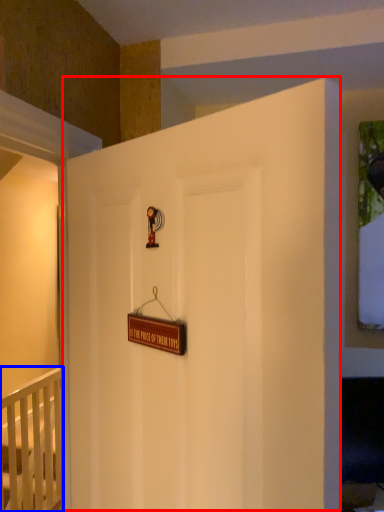
Question: Which point is further to the camera, door (highlighted by a red box) or infant bed (highlighted by a blue box)?

Choices:
 (A) door
 (B) infant bed

Answer: (B)